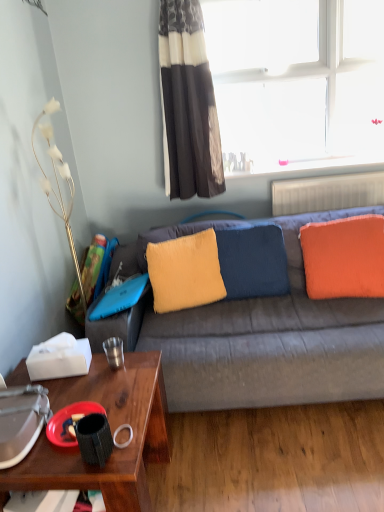
Question: From a real-world perspective, is metallic silver cup at lower left, the 1th coffee cup positioned from the back, beneath black and white striped curtain at upper center?

Choices:
 (A) yes
 (B) no

Answer: (A)

Question: Considering the relative positions of metallic silver cup at lower left, marked as the 2th coffee cup in a front-to-back arrangement, and black and white striped curtain at upper center in the image provided, is metallic silver cup at lower left, marked as the 2th coffee cup in a front-to-back arrangement, to the right of black and white striped curtain at upper center from the viewer's perspective?

Choices:
 (A) yes
 (B) no

Answer: (B)

Question: Would you say metallic silver cup at lower left, the 1th coffee cup positioned from the back, contains black and white striped curtain at upper center?

Choices:
 (A) no
 (B) yes

Answer: (A)

Question: Is metallic silver cup at lower left, the 1th coffee cup positioned from the back, turned away from black and white striped curtain at upper center?

Choices:
 (A) yes
 (B) no

Answer: (B)

Question: Considering the relative sizes of metallic silver cup at lower left, which is the 2th coffee cup in bottom-to-top order, and black and white striped curtain at upper center in the image provided, is metallic silver cup at lower left, which is the 2th coffee cup in bottom-to-top order, wider than black and white striped curtain at upper center?

Choices:
 (A) no
 (B) yes

Answer: (A)

Question: Is the depth of wooden desk at lower left less than that of velvety yellow pillow at center, which is the 2th pillow in right-to-left order?

Choices:
 (A) no
 (B) yes

Answer: (B)

Question: Is wooden desk at lower left shorter than velvety yellow pillow at center, which is the 2th pillow in right-to-left order?

Choices:
 (A) no
 (B) yes

Answer: (A)

Question: Is wooden desk at lower left positioned behind velvety yellow pillow at center, which is the 2th pillow in right-to-left order?

Choices:
 (A) yes
 (B) no

Answer: (B)

Question: From the image's perspective, is wooden desk at lower left on velvety yellow pillow at center, which is the 2th pillow in right-to-left order?

Choices:
 (A) no
 (B) yes

Answer: (A)

Question: From a real-world perspective, is wooden desk at lower left positioned under velvety yellow pillow at center, which appears as the 2th pillow when viewed from the left, based on gravity?

Choices:
 (A) yes
 (B) no

Answer: (A)

Question: Is wooden desk at lower left looking in the opposite direction of velvety yellow pillow at center, which is the 2th pillow in right-to-left order?

Choices:
 (A) yes
 (B) no

Answer: (B)

Question: Is velvety yellow pillow at center, which is the 2th pillow in right-to-left order, taller than metallic silver cup at lower left, which is the 2th coffee cup in bottom-to-top order?

Choices:
 (A) yes
 (B) no

Answer: (A)